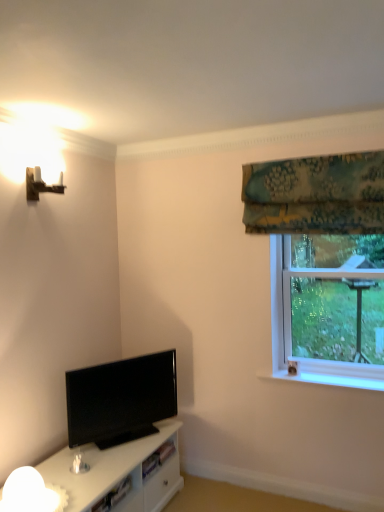
Question: Is transparent glass window at upper right outside white frosted glass lamp at lower left?

Choices:
 (A) no
 (B) yes

Answer: (B)

Question: Is transparent glass window at upper right placed right next to white frosted glass lamp at lower left?

Choices:
 (A) no
 (B) yes

Answer: (A)

Question: Considering the relative sizes of transparent glass window at upper right and white frosted glass lamp at lower left in the image provided, is transparent glass window at upper right shorter than white frosted glass lamp at lower left?

Choices:
 (A) yes
 (B) no

Answer: (B)

Question: Does transparent glass window at upper right contain white frosted glass lamp at lower left?

Choices:
 (A) yes
 (B) no

Answer: (B)

Question: Is transparent glass window at upper right positioned far away from white frosted glass lamp at lower left?

Choices:
 (A) yes
 (B) no

Answer: (A)

Question: Would you say black glossy tv at lower left is to the left or to the right of wooden wall sconce at upper left in the picture?

Choices:
 (A) left
 (B) right

Answer: (B)

Question: Considering the positions of black glossy tv at lower left and wooden wall sconce at upper left in the image, is black glossy tv at lower left taller or shorter than wooden wall sconce at upper left?

Choices:
 (A) short
 (B) tall

Answer: (B)

Question: In terms of width, does black glossy tv at lower left look wider or thinner when compared to wooden wall sconce at upper left?

Choices:
 (A) wide
 (B) thin

Answer: (B)

Question: Is point (172, 355) positioned closer to the camera than point (41, 190)?

Choices:
 (A) closer
 (B) farther

Answer: (B)

Question: Is wooden wall sconce at upper left taller or shorter than black glossy tv at lower left?

Choices:
 (A) short
 (B) tall

Answer: (A)

Question: Which is correct: wooden wall sconce at upper left is inside black glossy tv at lower left, or outside of it?

Choices:
 (A) inside
 (B) outside

Answer: (B)

Question: From the image's perspective, relative to black glossy tv at lower left, is wooden wall sconce at upper left above or below?

Choices:
 (A) above
 (B) below

Answer: (A)

Question: From a real-world perspective, is wooden wall sconce at upper left positioned above or below black glossy tv at lower left?

Choices:
 (A) below
 (B) above

Answer: (B)

Question: Is black glossy tv at lower left spatially inside transparent glass window at upper right, or outside of it?

Choices:
 (A) inside
 (B) outside

Answer: (B)

Question: Considering the relative positions of black glossy tv at lower left and transparent glass window at upper right in the image provided, is black glossy tv at lower left to the left or to the right of transparent glass window at upper right?

Choices:
 (A) left
 (B) right

Answer: (A)